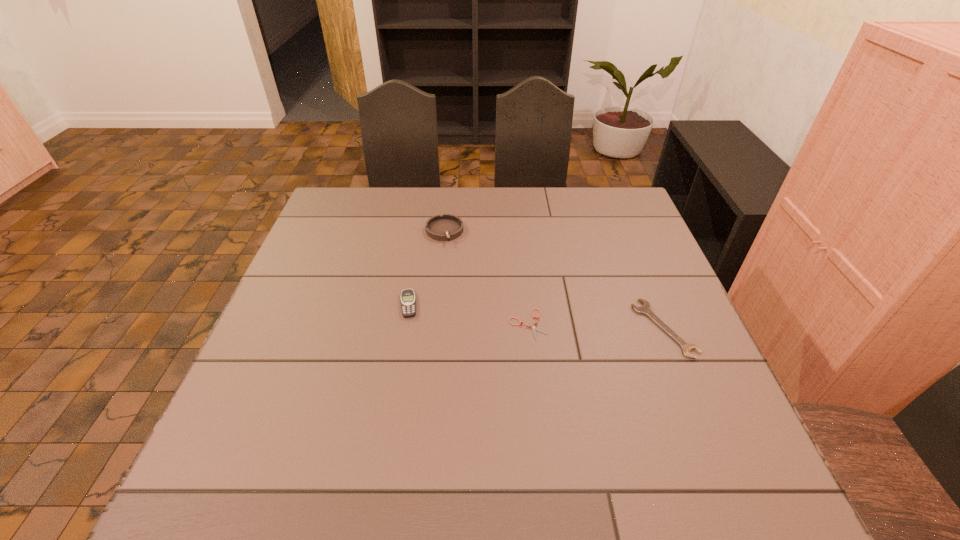
You are a GUI agent. You are given a task and a screenshot of the screen. Output one action in this format:
    pyautogui.click(x=<x>, y=<y>)
    Task: Click on the vacant region located on the left of the second object from right to left
    
    Given the screenshot: What is the action you would take?
    pyautogui.click(x=454, y=324)

Where is `object that is at the far edge`? The image size is (960, 540). object that is at the far edge is located at coordinates (446, 227).

Find the location of a particular element. Image resolution: width=960 pixels, height=540 pixels. object positioned at the right edge is located at coordinates (646, 309).

Locate an element on the screen. The image size is (960, 540). vacant space at the far edge is located at coordinates (x=475, y=227).

In the image, there is a desktop. Identify the location of vacant area at the near edge. (678, 499).

Image resolution: width=960 pixels, height=540 pixels. What are the coordinates of `vacant space at the left edge of the desktop` in the screenshot? It's located at (274, 410).

This screenshot has width=960, height=540. I want to click on vacant space at the far left corner of the desktop, so click(x=359, y=224).

Where is `free spot at the near left corner of the desktop`? free spot at the near left corner of the desktop is located at coordinates 229,500.

In the image, there is a desktop. Where is `vacant space at the far right corner`? vacant space at the far right corner is located at coordinates (617, 200).

Find the location of a particular element. vacant space at the near right corner of the desktop is located at coordinates (721, 508).